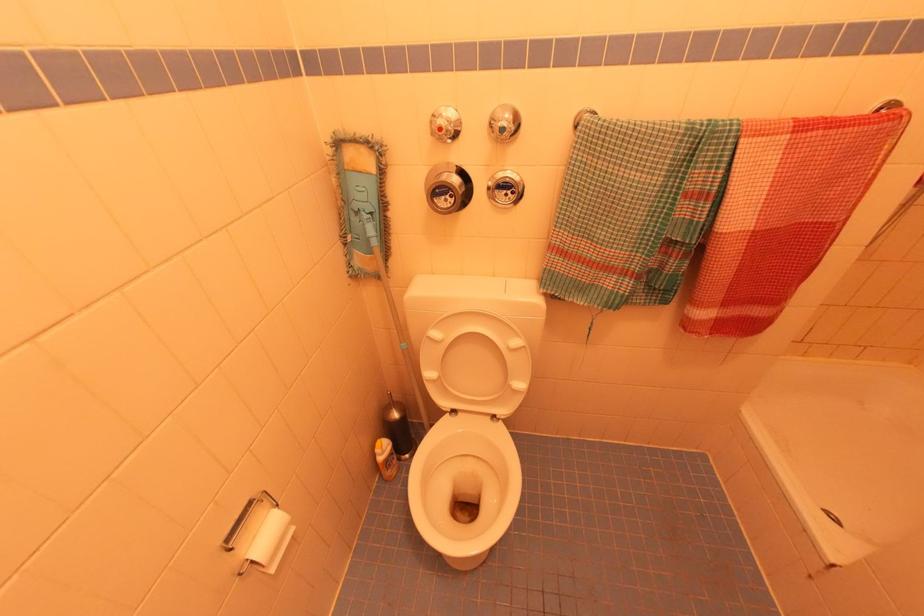
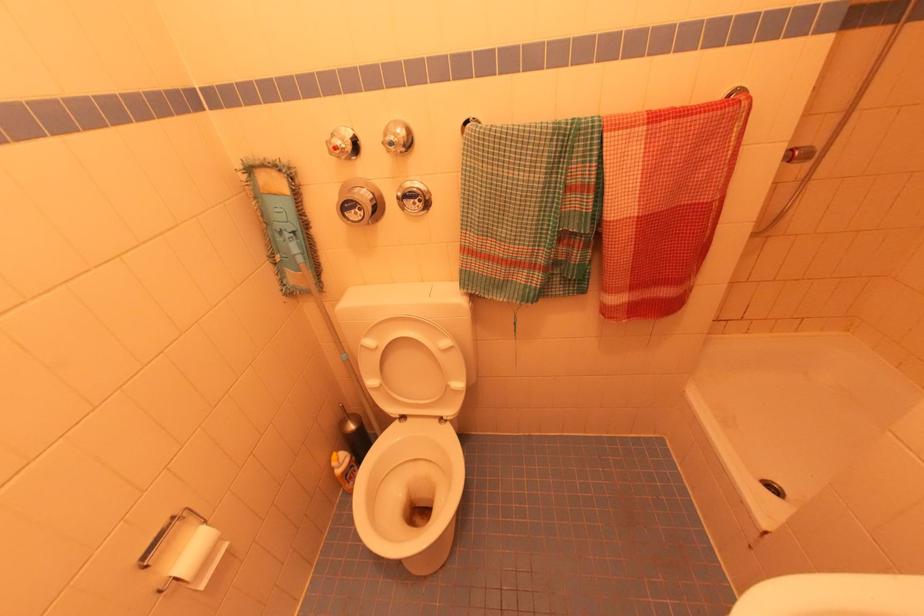
Question: The images are taken continuously from a first-person perspective. In which direction are you moving?

Choices:
 (A) Left
 (B) Right
 (C) Forward
 (D) Backward

Answer: (B)